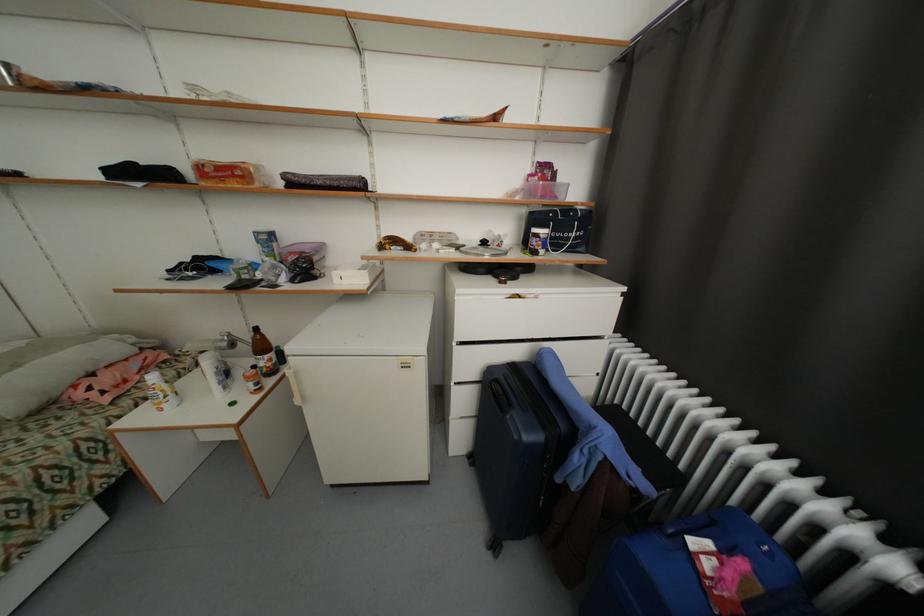
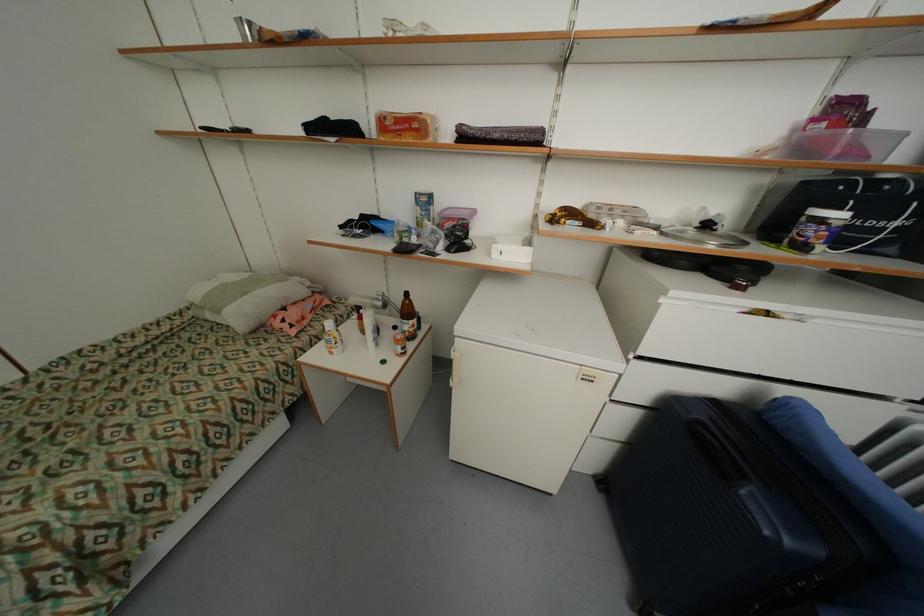
In the second image, find the point that corresponds to (x=245, y=174) in the first image.

(421, 126)